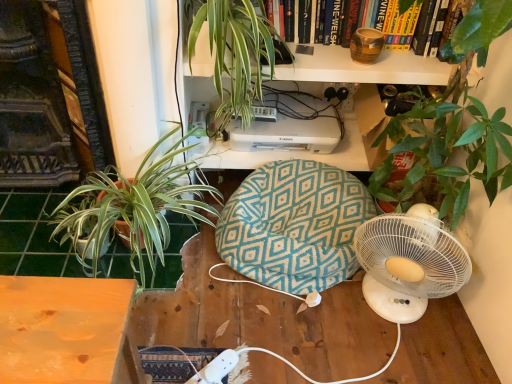
Find the location of a particular element. This screenshot has width=512, height=384. green leafy plant at left, arranged as the 2th houseplant when viewed from the top is located at coordinates (135, 206).

The height and width of the screenshot is (384, 512). What do you see at coordinates (288, 134) in the screenshot?
I see `white plastic printer at upper center` at bounding box center [288, 134].

Image resolution: width=512 pixels, height=384 pixels. What are the coordinates of `green leafy plant at left, arranged as the 2th houseplant when viewed from the top` in the screenshot? It's located at (135, 206).

From the image's perspective, which one is positioned higher, green leafy plant at left, the 1th houseplant from the bottom, or green leafy plant at upper center, which is counted as the first houseplant, starting from the top?

green leafy plant at upper center, which is counted as the first houseplant, starting from the top, is shown above in the image.

From their relative heights in the image, would you say green leafy plant at left, arranged as the 2th houseplant when viewed from the top, is taller or shorter than green leafy plant at upper center, arranged as the 2th houseplant when ordered from the bottom?

green leafy plant at left, arranged as the 2th houseplant when viewed from the top, is shorter than green leafy plant at upper center, arranged as the 2th houseplant when ordered from the bottom.

Would you say green leafy plant at left, arranged as the 2th houseplant when viewed from the top, is to the left or to the right of green leafy plant at upper center, which is counted as the first houseplant, starting from the top, in the picture?

Based on their positions, green leafy plant at left, arranged as the 2th houseplant when viewed from the top, is located to the left of green leafy plant at upper center, which is counted as the first houseplant, starting from the top.

Is green leafy plant at left, the 1th houseplant from the bottom, in front of green leafy plant at upper center, which is counted as the first houseplant, starting from the top?

That is False.

Is green tile at lower left oriented away from green leafy plant at left, the 1th houseplant from the bottom?

No, green leafy plant at left, the 1th houseplant from the bottom, is not at the back of green tile at lower left.

Measure the distance between green tile at lower left and green leafy plant at left, the 1th houseplant from the bottom.

green tile at lower left is 18.78 centimeters away from green leafy plant at left, the 1th houseplant from the bottom.

Is green tile at lower left shorter than green leafy plant at left, the 1th houseplant from the bottom?

Indeed, green tile at lower left has a lesser height compared to green leafy plant at left, the 1th houseplant from the bottom.

Is green tile at lower left touching green leafy plant at left, arranged as the 2th houseplant when viewed from the top?

green tile at lower left is not next to green leafy plant at left, arranged as the 2th houseplant when viewed from the top, and they're not touching.

In the scene shown: Is green tile at lower left not near teal fabric bean bag at center?

green tile at lower left is actually quite close to teal fabric bean bag at center.

The width and height of the screenshot is (512, 384). In order to click on tile below the teal fabric bean bag at center (from a real-world perspective) in this screenshot , I will do `click(33, 236)`.

From the image's perspective, would you say green tile at lower left is shown under teal fabric bean bag at center?

Yes, from the image's perspective, green tile at lower left is beneath teal fabric bean bag at center.

Looking at the image, does green tile at lower left seem bigger or smaller compared to teal fabric bean bag at center?

In the image, green tile at lower left appears to be smaller than teal fabric bean bag at center.

Considering the sizes of objects green leafy plant at upper center, which is counted as the first houseplant, starting from the top, and white plastic printer at upper center in the image provided, who is taller, green leafy plant at upper center, which is counted as the first houseplant, starting from the top, or white plastic printer at upper center?

Standing taller between the two is green leafy plant at upper center, which is counted as the first houseplant, starting from the top.

Can you confirm if green leafy plant at upper center, which is counted as the first houseplant, starting from the top, is positioned to the right of white plastic printer at upper center?

In fact, green leafy plant at upper center, which is counted as the first houseplant, starting from the top, is to the left of white plastic printer at upper center.

Where is `printer below the green leafy plant at upper center, which is counted as the first houseplant, starting from the top (from a real-world perspective)`? printer below the green leafy plant at upper center, which is counted as the first houseplant, starting from the top (from a real-world perspective) is located at coordinates (288, 134).

Does point (269, 42) come closer to viewer compared to point (326, 137)?

That is True.

Between point (203, 221) and point (25, 223), which one is positioned behind?

The point (203, 221) is behind.

From the image's perspective, is green leafy plant at left, the 1th houseplant from the bottom, above green tile at lower left?

Indeed, from the image's perspective, green leafy plant at left, the 1th houseplant from the bottom, is shown above green tile at lower left.

Is green tile at lower left surrounded by green leafy plant at left, arranged as the 2th houseplant when viewed from the top?

Definitely not — green tile at lower left is not inside green leafy plant at left, arranged as the 2th houseplant when viewed from the top.

How many degrees apart are the facing directions of green leafy plant at left, the 1th houseplant from the bottom, and green tile at lower left?

The angle between the facing direction of green leafy plant at left, the 1th houseplant from the bottom, and the facing direction of green tile at lower left is 0.793 degrees.

Is green tile at lower left turned away from green leafy plant at upper center, which is counted as the first houseplant, starting from the top?

No.

Based on the photo, between green tile at lower left and green leafy plant at upper center, arranged as the 2th houseplant when ordered from the bottom, which one is positioned behind?

green tile at lower left is further away from the camera.

Between green tile at lower left and green leafy plant at upper center, which is counted as the first houseplant, starting from the top, which one appears on the right side from the viewer's perspective?

green leafy plant at upper center, which is counted as the first houseplant, starting from the top.

Does green leafy plant at upper center, which is counted as the first houseplant, starting from the top, lie in front of green leafy plant at left, arranged as the 2th houseplant when viewed from the top?

That is True.

Can you tell me how much green leafy plant at upper center, which is counted as the first houseplant, starting from the top, and green leafy plant at left, arranged as the 2th houseplant when viewed from the top, differ in facing direction?

The angle between the facing direction of green leafy plant at upper center, which is counted as the first houseplant, starting from the top, and the facing direction of green leafy plant at left, arranged as the 2th houseplant when viewed from the top, is 0.678 degrees.

Which object is thinner, green leafy plant at upper center, arranged as the 2th houseplant when ordered from the bottom, or green leafy plant at left, arranged as the 2th houseplant when viewed from the top?

green leafy plant at left, arranged as the 2th houseplant when viewed from the top, is thinner.

From a real-world perspective, is green leafy plant at upper center, arranged as the 2th houseplant when ordered from the bottom, over green leafy plant at left, the 1th houseplant from the bottom?

Indeed, from a real-world perspective, green leafy plant at upper center, arranged as the 2th houseplant when ordered from the bottom, stands above green leafy plant at left, the 1th houseplant from the bottom.

At what (x,y) coordinates should I click in order to perform the action: click on houseplant behind the green leafy plant at upper center, arranged as the 2th houseplant when ordered from the bottom. Please return your answer as a coordinate pair (x, y). Looking at the image, I should click on (135, 206).

From a real-world perspective, which houseplant is the 1st one above the green tile at lower left? Please provide its 2D coordinates.

[(135, 206)]

Looking at this image, considering their positions, is brown textured vase at upper center positioned further to green tile at lower left than teal fabric bean bag at center?

Among the two, brown textured vase at upper center is located further to green tile at lower left.

Based on their spatial positions, is white plastic printer at upper center or green leafy plant at upper center, which is counted as the first houseplant, starting from the top, further from green tile at lower left?

green leafy plant at upper center, which is counted as the first houseplant, starting from the top, is further to green tile at lower left.

Based on their spatial positions, is white plastic printer at upper center or teal fabric bean bag at center closer to green tile at lower left?

Among the two, teal fabric bean bag at center is located nearer to green tile at lower left.

Estimate the real-world distances between objects in this image. Which object is further from green leafy plant at upper center, arranged as the 2th houseplant when ordered from the bottom, green leafy plant at left, the 1th houseplant from the bottom, or teal fabric bean bag at center?

teal fabric bean bag at center.

Based on their spatial positions, is white plastic printer at upper center or green leafy plant at upper center, which is counted as the first houseplant, starting from the top, closer to brown textured vase at upper center?

Among the two, green leafy plant at upper center, which is counted as the first houseplant, starting from the top, is located nearer to brown textured vase at upper center.

When comparing their distances from teal fabric bean bag at center, does white plastic printer at upper center or green leafy plant at left, the 1th houseplant from the bottom, seem further?

green leafy plant at left, the 1th houseplant from the bottom.

Looking at the image, which one is located closer to green leafy plant at left, arranged as the 2th houseplant when viewed from the top, green leafy plant at upper center, arranged as the 2th houseplant when ordered from the bottom, or white plastic printer at upper center?

The object closer to green leafy plant at left, arranged as the 2th houseplant when viewed from the top, is green leafy plant at upper center, arranged as the 2th houseplant when ordered from the bottom.

Which object lies nearer to the anchor point teal fabric bean bag at center, green leafy plant at upper center, which is counted as the first houseplant, starting from the top, or green leafy plant at left, the 1th houseplant from the bottom?

green leafy plant at left, the 1th houseplant from the bottom, lies closer to teal fabric bean bag at center than the other object.

You are a GUI agent. You are given a task and a screenshot of the screen. Output one action in this format:
    pyautogui.click(x=<x>, y=<y>)
    Task: Click on the houseplant between green leafy plant at upper center, which is counted as the first houseplant, starting from the top, and teal fabric bean bag at center, in the vertical direction
    This screenshot has height=384, width=512.
    Given the screenshot: What is the action you would take?
    pyautogui.click(x=135, y=206)

I want to click on printer between green leafy plant at left, arranged as the 2th houseplant when viewed from the top, and teal fabric bean bag at center from left to right, so click(x=288, y=134).

Image resolution: width=512 pixels, height=384 pixels. I want to click on bean bag chair between green tile at lower left and brown textured vase at upper center in the horizontal direction, so click(294, 225).

The image size is (512, 384). Identify the location of printer that lies between green leafy plant at upper center, arranged as the 2th houseplant when ordered from the bottom, and teal fabric bean bag at center from top to bottom. (288, 134).